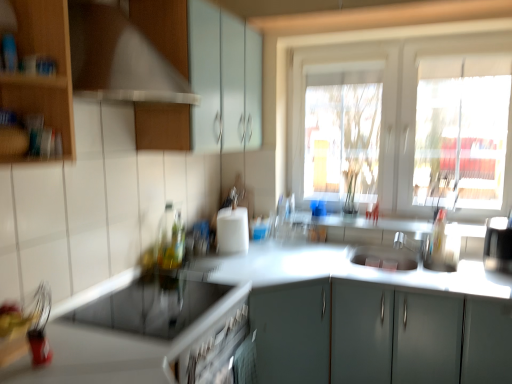
Question: Is wooden cabinet at left, marked as the first cabinetry in a left-to-right arrangement, bigger or smaller than white glossy countertop at center, positioned as the 1th countertop in bottom-to-top order?

Choices:
 (A) big
 (B) small

Answer: (B)

Question: From the image's perspective, relative to white glossy countertop at center, which ranks as the second countertop in top-to-bottom order, is wooden cabinet at left, marked as the first cabinetry in a left-to-right arrangement, above or below?

Choices:
 (A) below
 (B) above

Answer: (B)

Question: Which object is positioned closest to the wooden cabinet at left, marked as the third cabinetry in a right-to-left arrangement?

Choices:
 (A) matte white cabinet at upper center, arranged as the 3th cabinetry when ordered from the bottom
 (B) silver metallic faucet at center
 (C) translucent glass bottle at center, the 1th bottle viewed from the front
 (D) translucent glass bottle at center, marked as the first bottle in a back-to-front arrangement
 (E) wooden at left

Answer: (E)

Question: Based on their relative distances, which object is farther from the matte gray cabinet at center, placed as the 3th cabinetry when sorted from top to bottom?

Choices:
 (A) wooden at left
 (B) sleek silver coffee machine at right
 (C) white glossy countertop at center, positioned as the 1th countertop in bottom-to-top order
 (D) white glossy window at upper center
 (E) matte white cabinet at upper center, arranged as the 3th cabinetry when ordered from the bottom

Answer: (A)